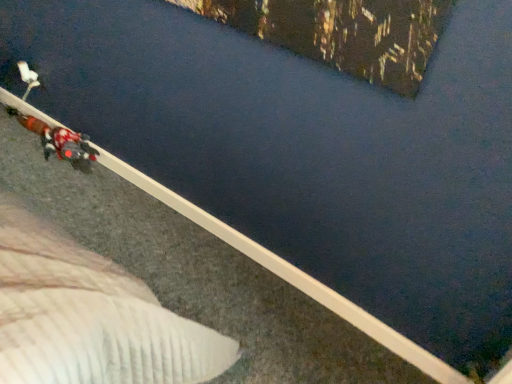
You are a GUI agent. You are given a task and a screenshot of the screen. Output one action in this format:
    pyautogui.click(x=<x>, y=<y>)
    Task: Click on the free location to the left of velvet-like red coat at lower left
    
    Given the screenshot: What is the action you would take?
    pyautogui.click(x=19, y=149)